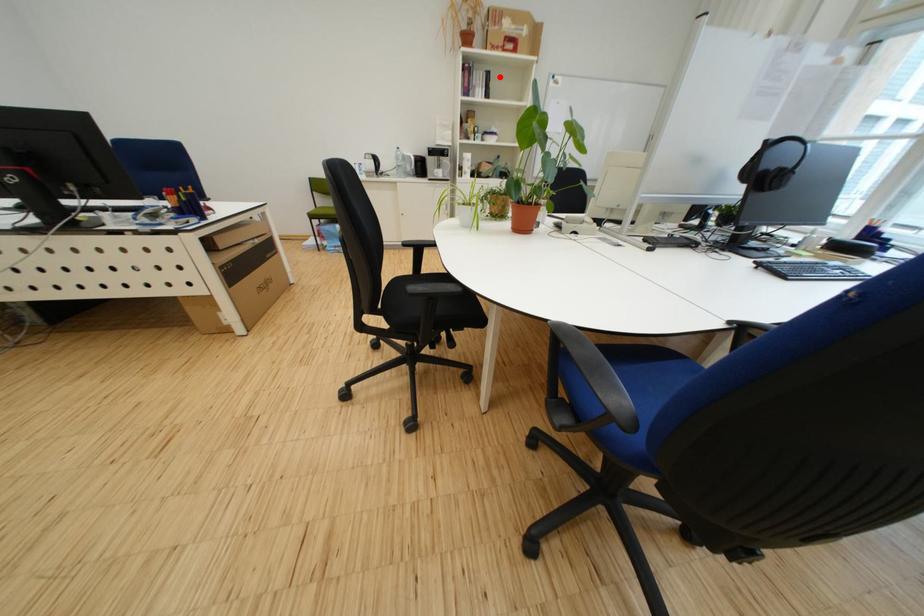
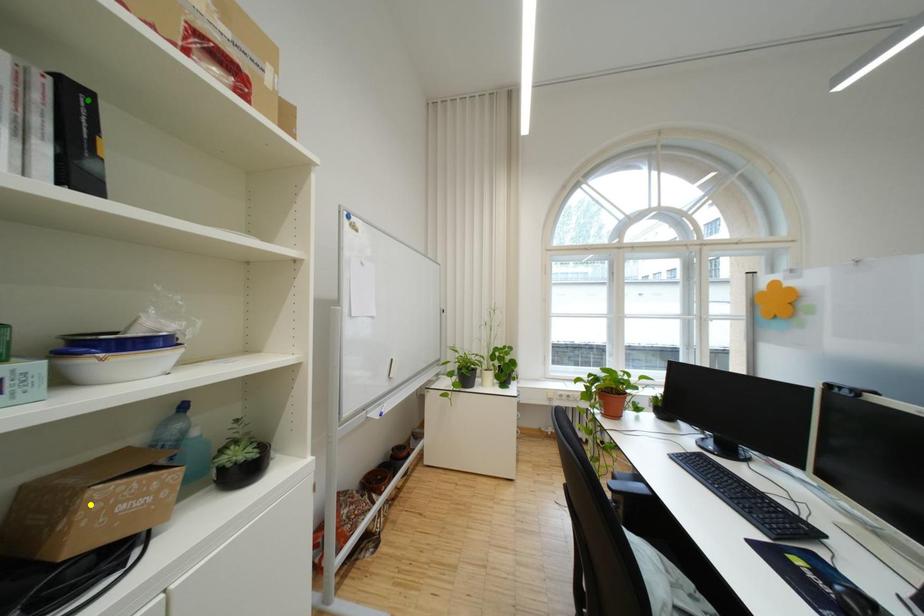
Question: I am providing you with two images of the same scene from different viewpoints. A red point is marked on the first image. You are given multiple points on the second image. In image 2, which mark is for the same physical point as the one in image 1?

Choices:
 (A) blue point
 (B) green point
 (C) yellow point

Answer: (B)